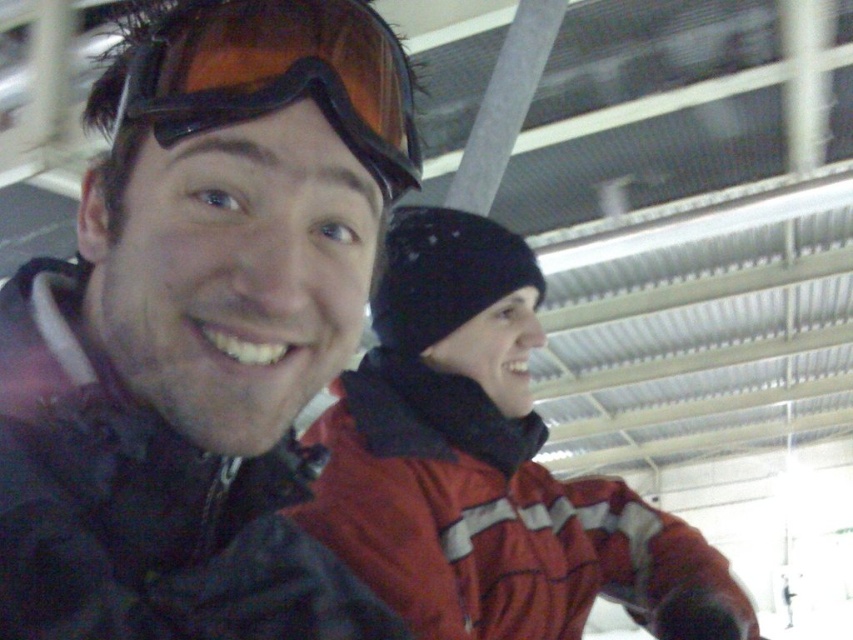
Question: Which of the following is the closest to the observer?

Choices:
 (A) red fabric jacket at center
 (B) matte black jacket at left

Answer: (B)

Question: Which point is closer to the camera?

Choices:
 (A) matte black jacket at left
 (B) matte orange ski goggles at upper left
 (C) red fabric jacket at center

Answer: (A)

Question: Which is farther from the red fabric jacket at center?

Choices:
 (A) matte orange ski goggles at upper left
 (B) matte black jacket at left

Answer: (A)

Question: Does matte black jacket at left have a greater width compared to red fabric jacket at center?

Choices:
 (A) yes
 (B) no

Answer: (B)

Question: Is red fabric jacket at center above matte orange ski goggles at upper left?

Choices:
 (A) yes
 (B) no

Answer: (B)

Question: Is matte black jacket at left to the left of red fabric jacket at center from the viewer's perspective?

Choices:
 (A) yes
 (B) no

Answer: (A)